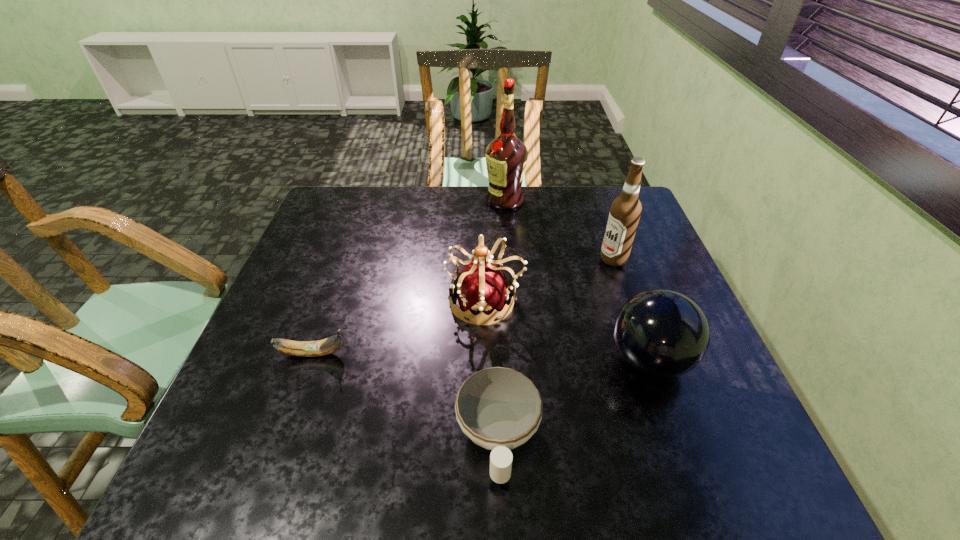
Identify the location of vacant space at the far right corner of the desktop. The image size is (960, 540). (599, 220).

Image resolution: width=960 pixels, height=540 pixels. In the image, there is a desktop. In order to click on vacant region at the near right corner in this screenshot , I will do `click(694, 458)`.

Locate an element on the screen. free area in between the tiara and the bowling ball is located at coordinates (567, 330).

Where is `vacant space that is in between the leftmost object and the chinaware`? vacant space that is in between the leftmost object and the chinaware is located at coordinates (405, 395).

The image size is (960, 540). What are the coordinates of `free area in between the chinaware and the banana` in the screenshot? It's located at (405, 395).

Find the location of a particular element. Image resolution: width=960 pixels, height=540 pixels. vacant space in between the chinaware and the bowling ball is located at coordinates (574, 399).

Locate an element on the screen. The image size is (960, 540). empty space that is in between the taller alcohol and the leftmost object is located at coordinates (409, 277).

This screenshot has height=540, width=960. In order to click on unoccupied position between the second tallest object and the chinaware in this screenshot , I will do `click(556, 348)`.

Point out which object is positioned as the fourth nearest to the tiara. Please provide its 2D coordinates. Your answer should be formatted as a tuple, i.e. [(x, y)], where the tuple contains the x and y coordinates of a point satisfying the conditions above.

[(625, 211)]

Identify the location of object that stands as the closest to the bowling ball. (499, 409).